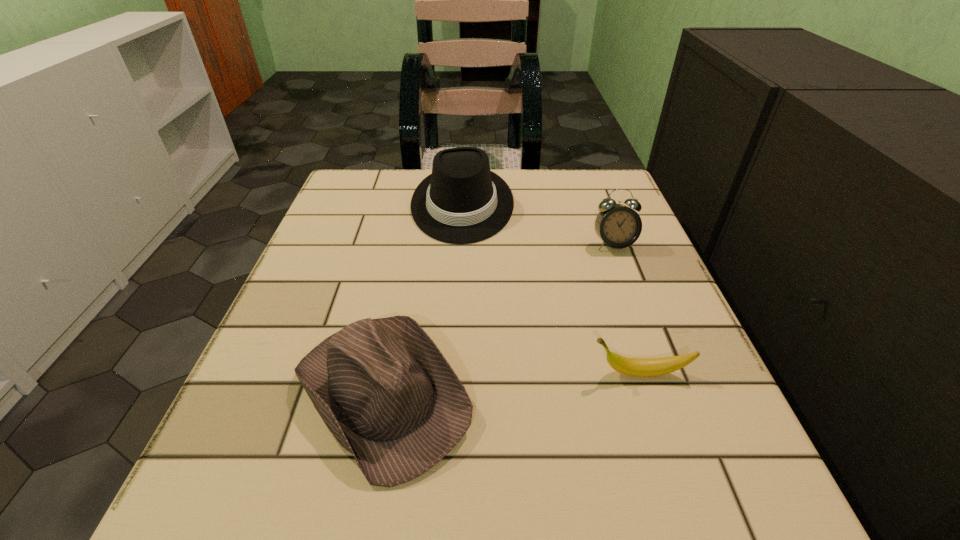
This screenshot has height=540, width=960. In order to click on the farther fedora in this screenshot , I will do (462, 201).

The image size is (960, 540). Find the location of `alarm clock`. alarm clock is located at coordinates (618, 226).

Identify the location of the nearer fedora. The image size is (960, 540). (383, 388).

You are a GUI agent. You are given a task and a screenshot of the screen. Output one action in this format:
    pyautogui.click(x=<x>, y=<y>)
    Task: Click on the banana
    Image resolution: width=960 pixels, height=540 pixels.
    Given the screenshot: What is the action you would take?
    pyautogui.click(x=641, y=367)

I want to click on blank space located on the front-facing side of the farther fedora, so click(x=452, y=385).

Locate an element on the screen. free location located 0.370m on the face of the alarm clock is located at coordinates (682, 424).

You are a GUI agent. You are given a task and a screenshot of the screen. Output one action in this format:
    pyautogui.click(x=<x>, y=<y>)
    Task: Click on the vacant space located 0.250m on the back of the nearer fedora
    
    Given the screenshot: What is the action you would take?
    pyautogui.click(x=414, y=235)

Where is `vacant space located at the stem of the shortest object`? vacant space located at the stem of the shortest object is located at coordinates point(509,373).

Where is `free spot located 0.150m at the stem of the shortest object`? This screenshot has width=960, height=540. free spot located 0.150m at the stem of the shortest object is located at coordinates (489, 373).

Where is `free space located at the stem of the shortest object`? free space located at the stem of the shortest object is located at coordinates click(388, 373).